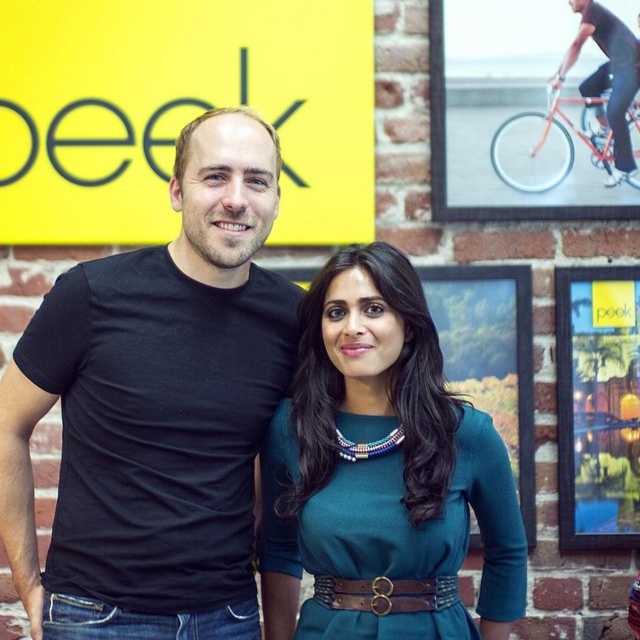
Who is positioned more to the right, matte black picture frame at center or brown leather belt at center?

matte black picture frame at center is more to the right.

Does point (632, 413) come closer to viewer compared to point (413, 600)?

No.

At what (x,y) coordinates should I click in order to perform the action: click on matte black picture frame at center. Please return your answer as a coordinate pair (x, y). Looking at the image, I should click on (596, 406).

Can you confirm if yellow matte/blackboard at upper left is positioned to the left of metallic bicycle at upper right?

Correct, you'll find yellow matte/blackboard at upper left to the left of metallic bicycle at upper right.

Is point (13, 77) positioned in front of point (429, 13)?

Yes, point (13, 77) is closer to viewer.

Where is `yellow matte/blackboard at upper left`? Image resolution: width=640 pixels, height=640 pixels. yellow matte/blackboard at upper left is located at coordinates (179, 112).

Which is more to the left, black cotton t-shirt at left or metallic bicycle at upper right?

Positioned to the left is black cotton t-shirt at left.

Is point (262, 403) positioned in front of point (429, 1)?

That is True.

Is point (208, 499) less distant than point (554, 216)?

Yes, point (208, 499) is closer to viewer.

Locate an element on the screen. black cotton t-shirt at left is located at coordinates (156, 397).